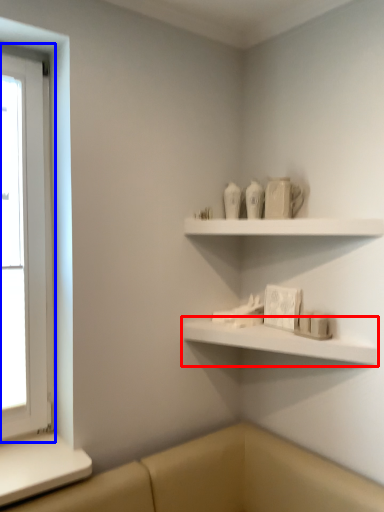
Question: Which of the following is the closest to the observer, shelf (highlighted by a red box) or window (highlighted by a blue box)?

Choices:
 (A) shelf
 (B) window

Answer: (A)